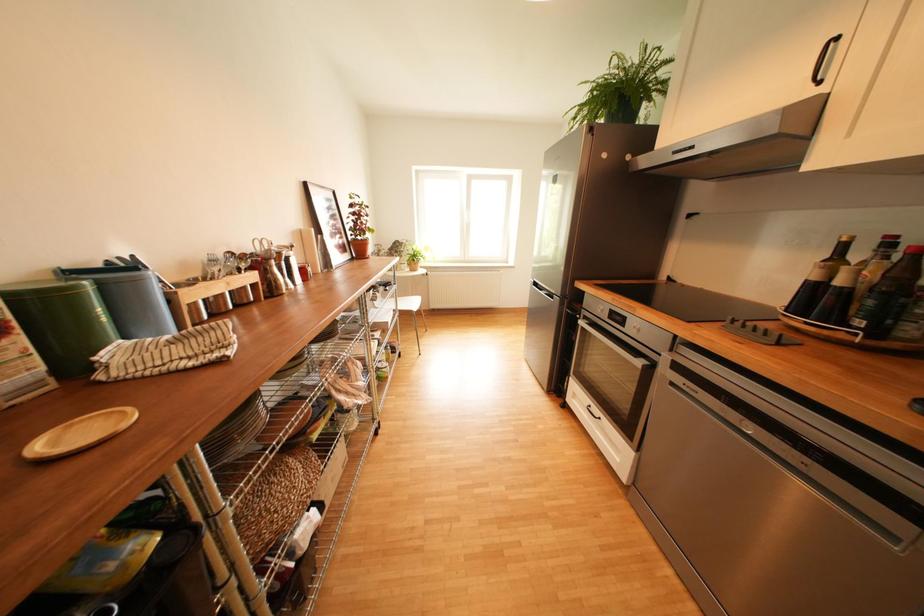
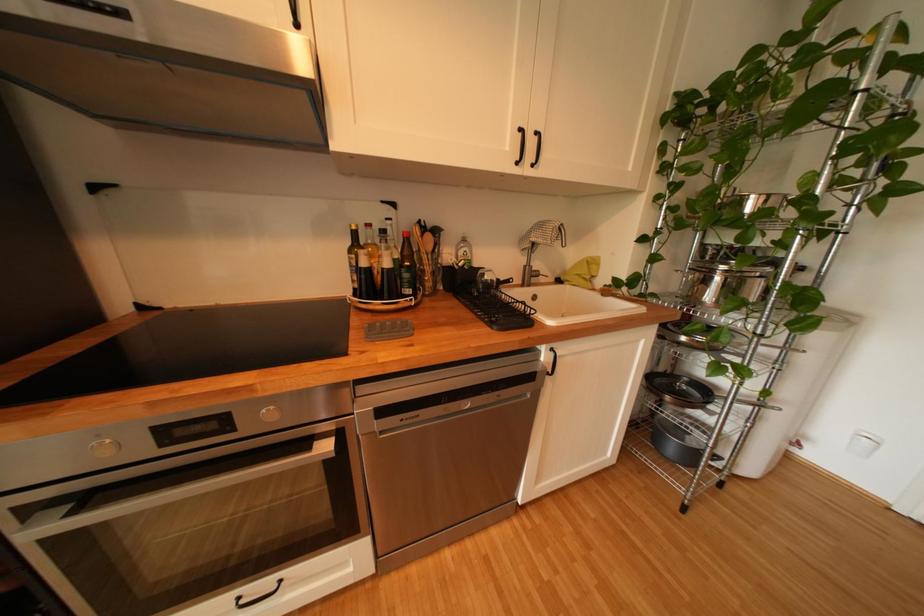
The first image is from the beginning of the video and the second image is from the end. How did the camera likely rotate when shooting the video?

The camera rotated toward right-down.